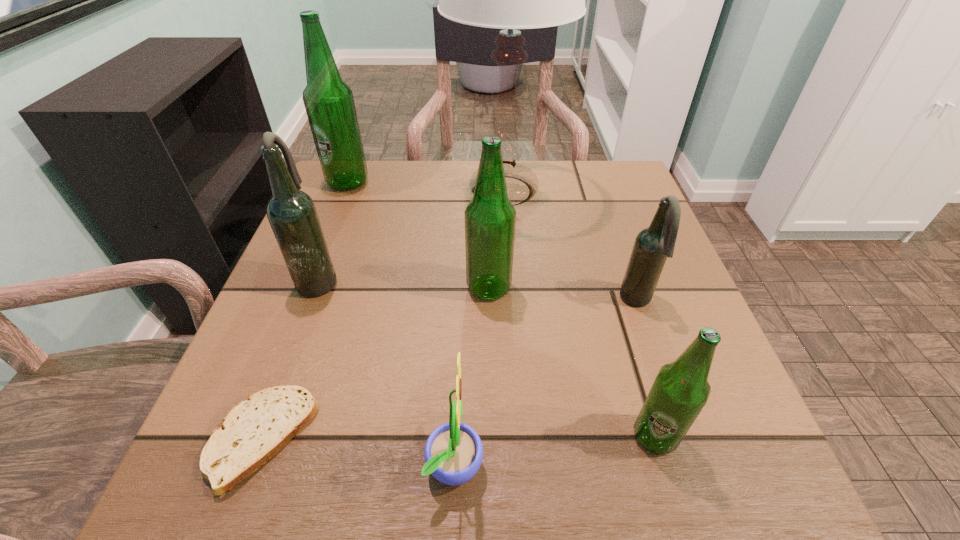
Where is `empty space between the right dark beer bottle and the tallest object`? empty space between the right dark beer bottle and the tallest object is located at coordinates (570, 246).

The width and height of the screenshot is (960, 540). Find the location of `blank region between the table lamp and the smaller dark beer bottle`. blank region between the table lamp and the smaller dark beer bottle is located at coordinates (570, 246).

Find the location of a particular element. empty space that is in between the pita bread and the right dark beer bottle is located at coordinates (448, 370).

Locate an element on the screen. The height and width of the screenshot is (540, 960). free space that is in between the seventh shortest object and the sunflower is located at coordinates (401, 322).

Where is `empty space between the pita bread and the bigger dark beer bottle`? This screenshot has height=540, width=960. empty space between the pita bread and the bigger dark beer bottle is located at coordinates (290, 359).

Find the location of a particular element. the seventh closest object relative to the right dark beer bottle is located at coordinates (329, 103).

You are a GUI agent. You are given a task and a screenshot of the screen. Output one action in this format:
    pyautogui.click(x=<x>, y=<y>)
    Task: Click on the third closest object to the tallest beer bottle
    
    Given the screenshot: What is the action you would take?
    pyautogui.click(x=490, y=217)

Select which beer bottle appears as the closest to the pita bread. Please provide its 2D coordinates. Your answer should be formatted as a tuple, i.e. [(x, y)], where the tuple contains the x and y coordinates of a point satisfying the conditions above.

[(292, 214)]

Where is `beer bottle that stands as the fifth closest to the tallest object`? This screenshot has height=540, width=960. beer bottle that stands as the fifth closest to the tallest object is located at coordinates (680, 391).

This screenshot has height=540, width=960. What are the coordinates of `the closest green beer bottle to the sunflower` in the screenshot? It's located at (680, 391).